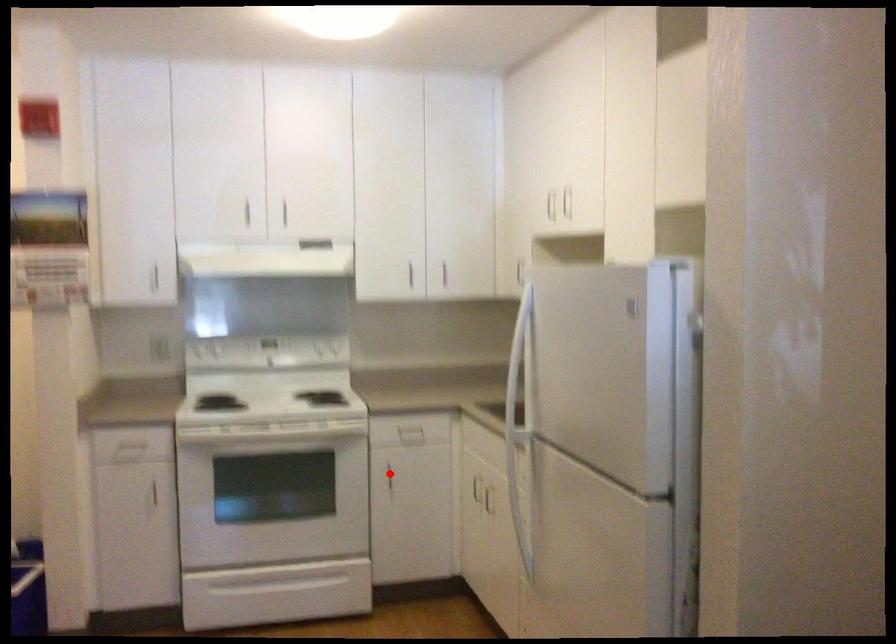
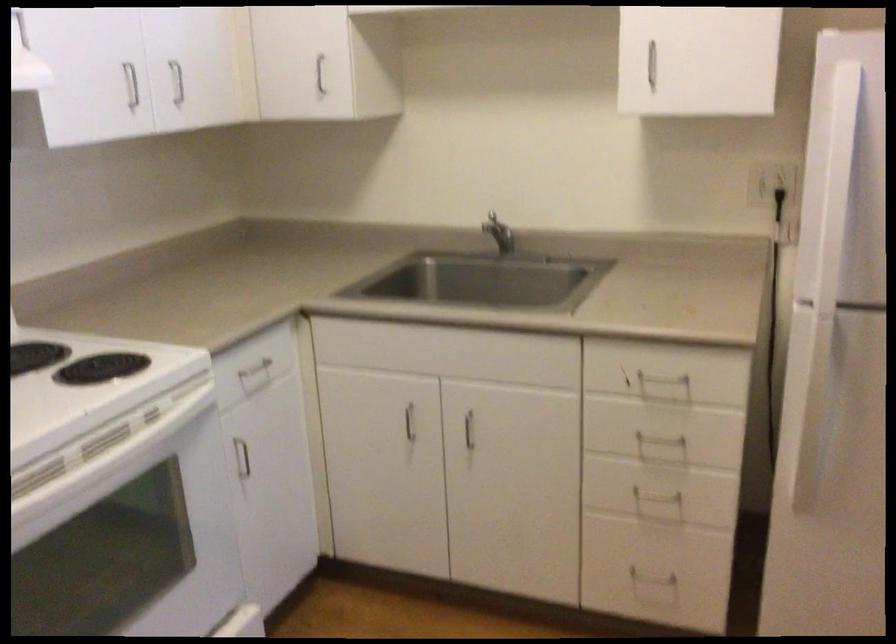
Where in the second image is the point corresponding to the highlighted location from the first image?

(242, 458)